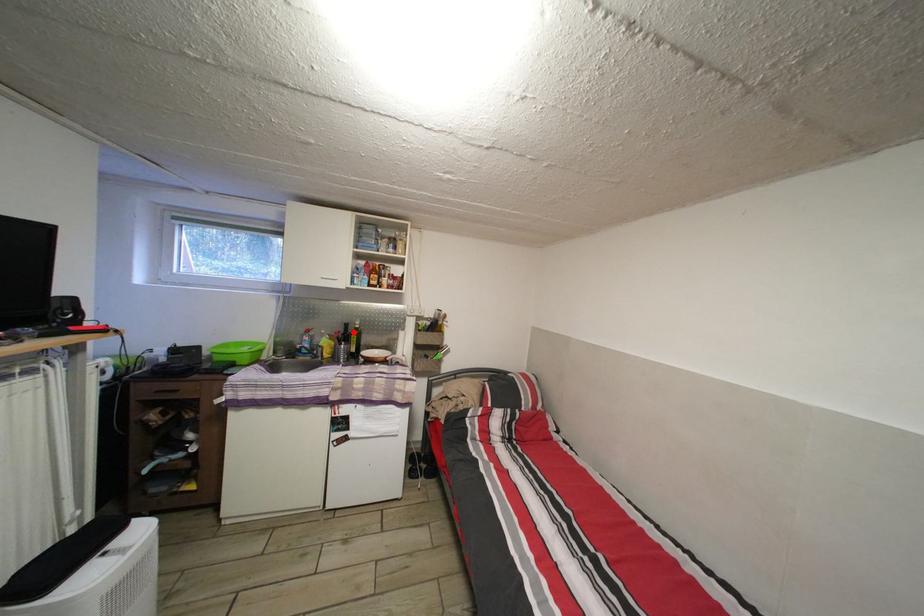
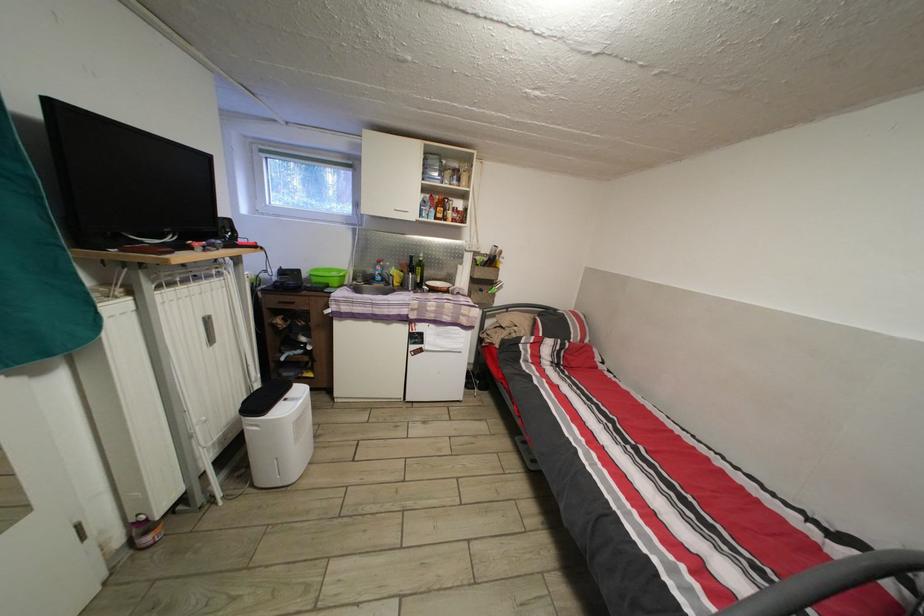
Question: I am providing you with two images of the same scene from different viewpoints. A red point is marked on the first image. Can you still see the location of the red point in image 2?

Choices:
 (A) Yes
 (B) No

Answer: (A)